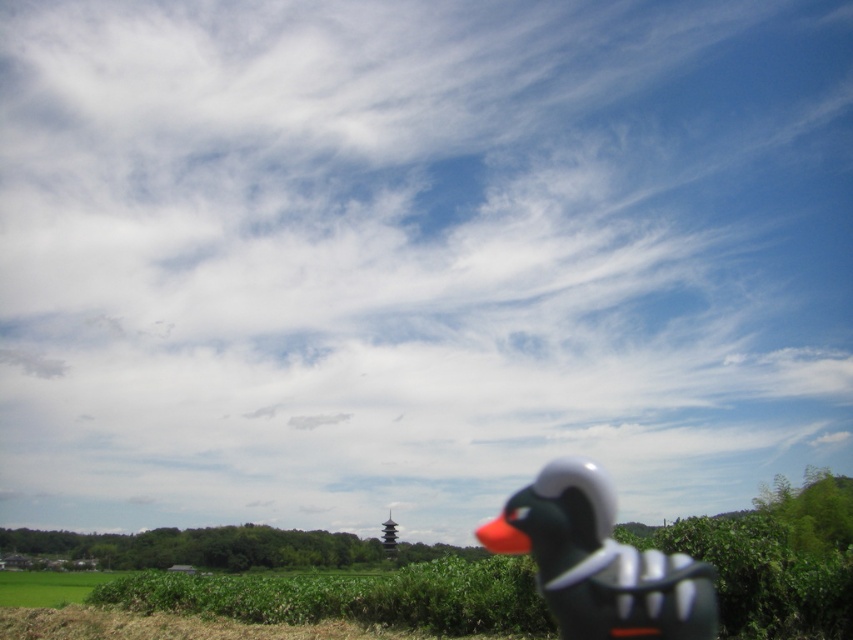
You are a photographer setting up a shot of the matte black rubber duck at lower right and the green grass at lower left. You want to emphasize the size difference between the two objects. Which object should you focus on to highlight its smaller size?

The matte black rubber duck at lower right has a lesser width compared to the green grass at lower left, so focusing on the matte black rubber duck at lower right will highlight its smaller size.

You are a photographer trying to capture a shot of the matte black rubber duck at lower right and the green grass at lower left. If you want to ensure both are in focus, what should you consider about their distance apart?

The matte black rubber duck at lower right is 17.47 meters away from the green grass at lower left. To have both in focus, you need to adjust the camera settings so that the depth of field can cover this distance between them.

In the scene shown: You are a photographer setting up a shot of the rural landscape. You want to ensure the matte black rubber duck at lower right and the green grass at lower left are both in focus. Which object should you focus on first if you want the closest one to be sharp?

The matte black rubber duck at lower right is located above the green grass at lower left, meaning it is closer to the camera. Therefore, you should focus on the matte black rubber duck at lower right first to ensure it is sharp.